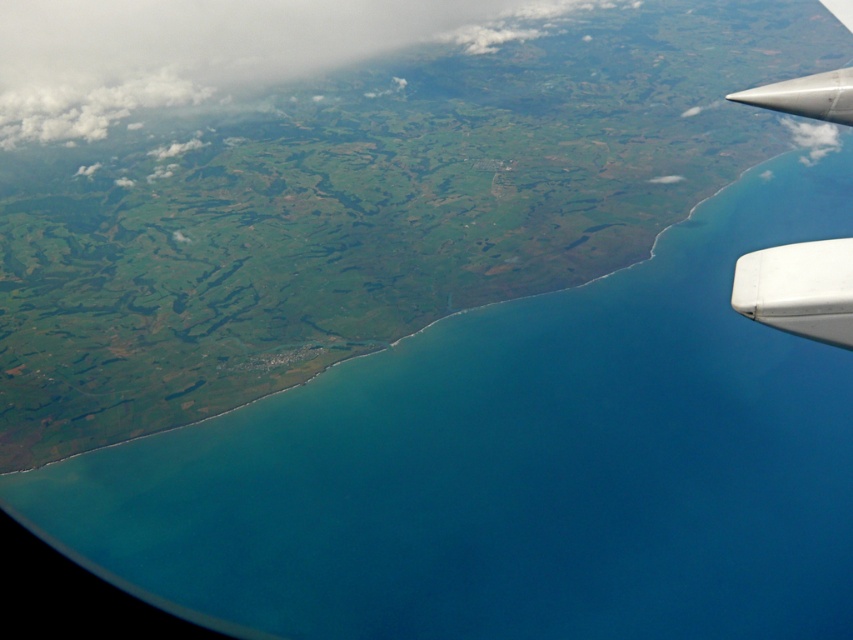
Question: Does white fluffy cloud at upper left appear under white matte wing at lower right?

Choices:
 (A) no
 (B) yes

Answer: (A)

Question: Which point is farther to the camera?

Choices:
 (A) white fluffy cloud at upper left
 (B) silver metallic winglet at upper right
 (C) white matte wing at lower right

Answer: (A)

Question: Does white fluffy cloud at upper left come in front of white matte wing at lower right?

Choices:
 (A) no
 (B) yes

Answer: (A)

Question: Estimate the real-world distances between objects in this image. Which object is closer to the silver metallic winglet at upper right?

Choices:
 (A) white fluffy cloud at upper left
 (B) white matte wing at lower right

Answer: (B)

Question: Which object is farther from the camera taking this photo?

Choices:
 (A) white fluffy cloud at upper left
 (B) white matte wing at lower right

Answer: (A)

Question: Can you confirm if white fluffy cloud at upper left is positioned below white matte wing at lower right?

Choices:
 (A) no
 (B) yes

Answer: (A)